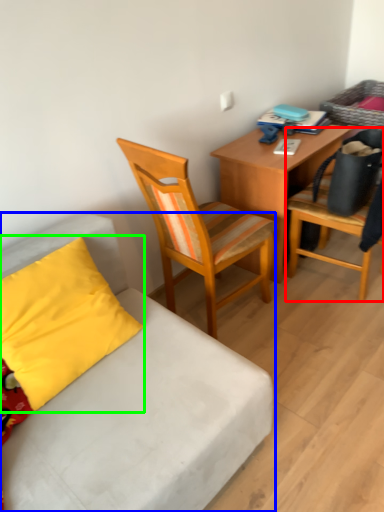
Question: Which is nearer to the chair (highlighted by a red box)? studio couch (highlighted by a blue box) or pillow (highlighted by a green box).

Choices:
 (A) studio couch
 (B) pillow

Answer: (A)